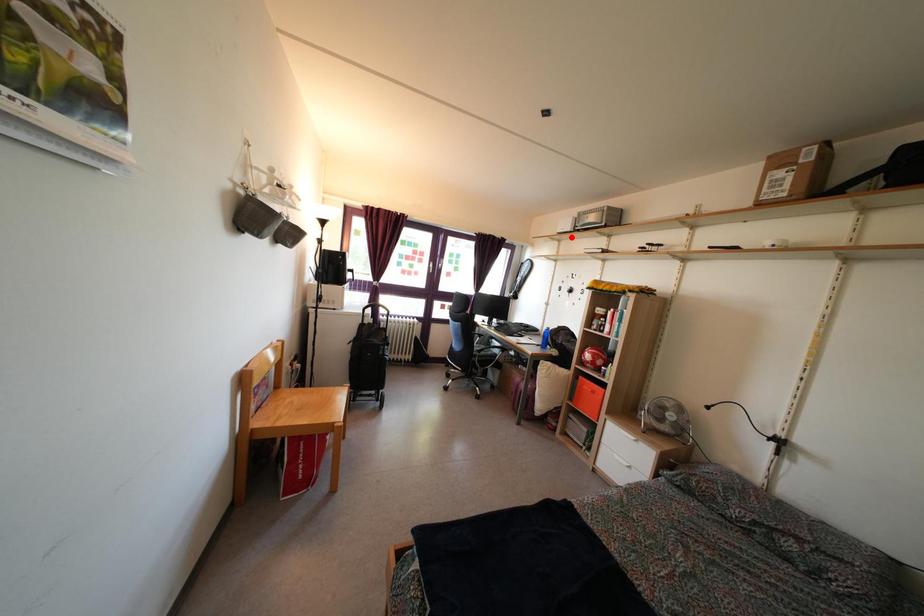
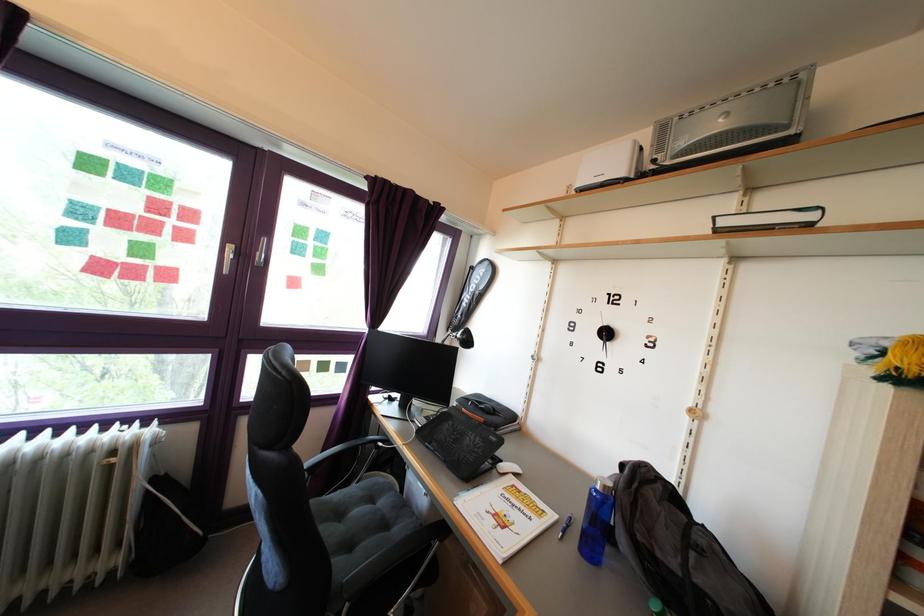
Find the pixel in the second image that matches the highlighted location in the first image.

(625, 179)